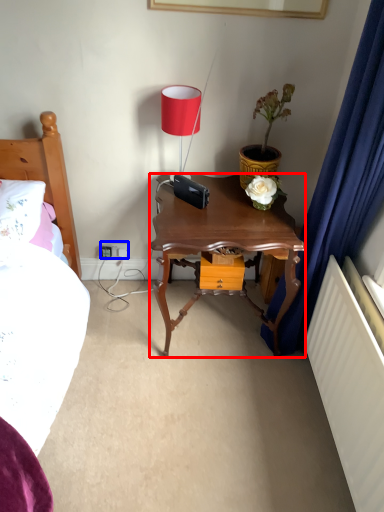
Question: Which of the following is the closest to the observer, nightstand (highlighted by a red box) or electric outlet (highlighted by a blue box)?

Choices:
 (A) nightstand
 (B) electric outlet

Answer: (A)